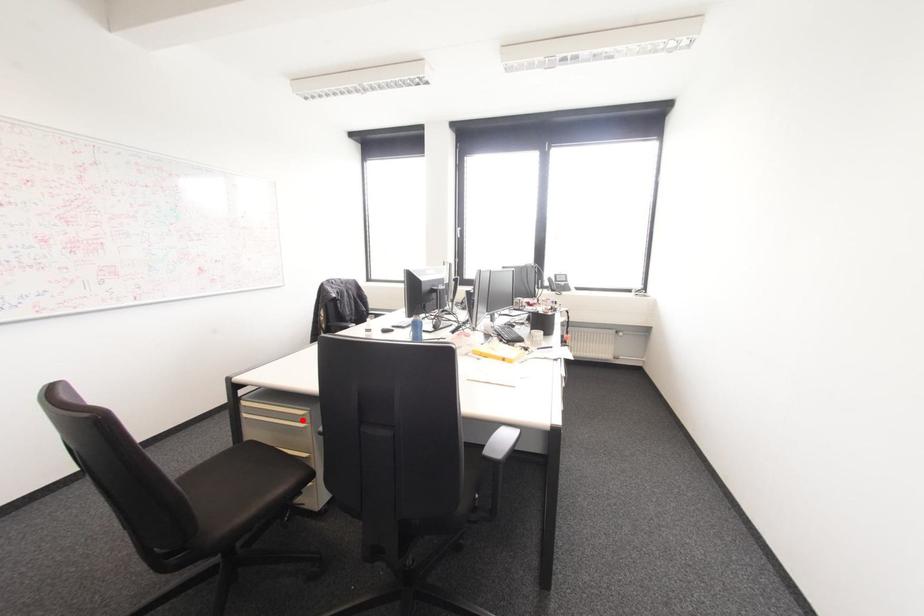
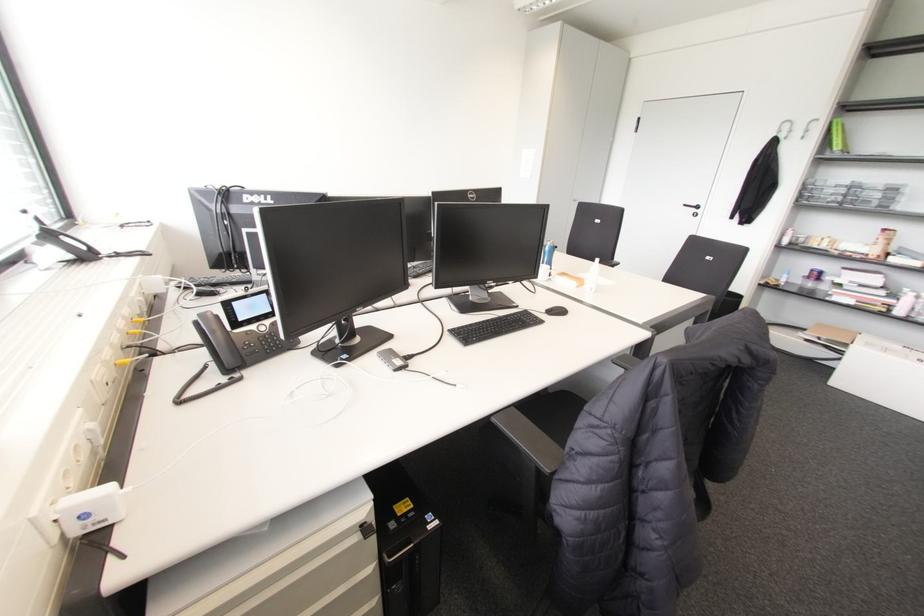
Question: I am providing you with two images of the same scene from different viewpoints. A red point is marked on the first image. Is the red point's position out of view in image 2?

Choices:
 (A) Yes
 (B) No

Answer: (A)